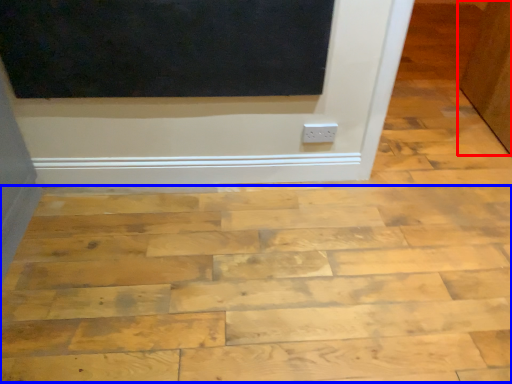
Question: Which of the following is the closest to the observer, door (highlighted by a red box) or plywood (highlighted by a blue box)?

Choices:
 (A) door
 (B) plywood

Answer: (B)